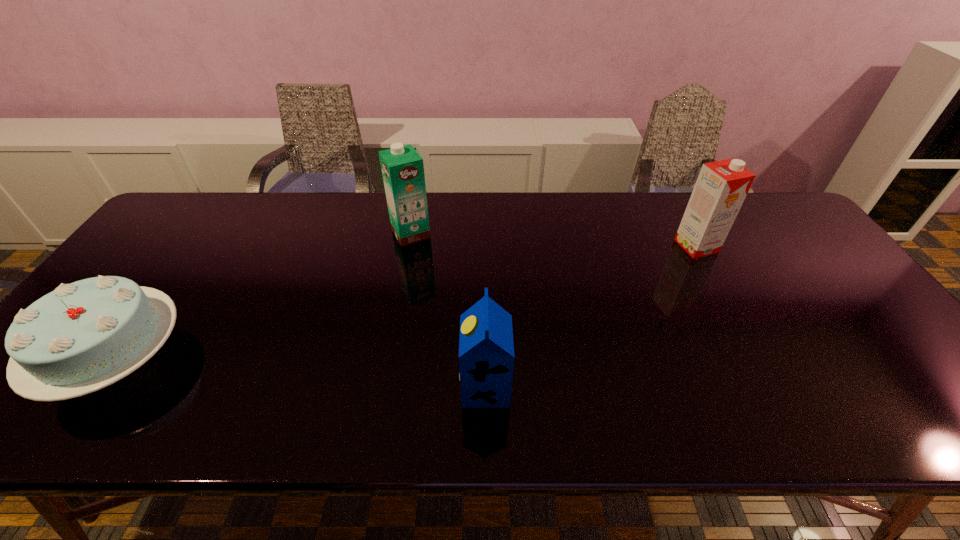
Find the location of a particular element. This screenshot has width=960, height=540. vacant space at the far edge of the desktop is located at coordinates (530, 212).

You are a GUI agent. You are given a task and a screenshot of the screen. Output one action in this format:
    pyautogui.click(x=<x>, y=<y>)
    Task: Click on the free region at the near edge of the desktop
    The width and height of the screenshot is (960, 540).
    Given the screenshot: What is the action you would take?
    pyautogui.click(x=324, y=422)

Where is `vacant space at the left edge of the desktop`? This screenshot has height=540, width=960. vacant space at the left edge of the desktop is located at coordinates pyautogui.click(x=155, y=272).

You are a GUI agent. You are given a task and a screenshot of the screen. Output one action in this format:
    pyautogui.click(x=<x>, y=<y>)
    Task: Click on the free space at the near right corner
    This screenshot has width=960, height=540.
    Given the screenshot: What is the action you would take?
    pyautogui.click(x=923, y=417)

Locate an element on the screen. The width and height of the screenshot is (960, 540). vacant space that's between the third object from right to left and the second carton from left to right is located at coordinates (448, 310).

The width and height of the screenshot is (960, 540). In order to click on unoccupied area between the leftmost carton and the second carton from right to left in this screenshot , I will do `click(448, 310)`.

This screenshot has width=960, height=540. In order to click on vacant area that lies between the rightmost carton and the leftmost carton in this screenshot , I will do `click(554, 240)`.

Where is `free area in between the second object from left to right and the rightmost carton`? The width and height of the screenshot is (960, 540). free area in between the second object from left to right and the rightmost carton is located at coordinates (554, 240).

This screenshot has width=960, height=540. What are the coordinates of `vacant area between the nearest carton and the rightmost object` in the screenshot? It's located at (591, 316).

Locate which object ranks third in proximity to the rightmost object. Please provide its 2D coordinates. Your answer should be formatted as a tuple, i.e. [(x, y)], where the tuple contains the x and y coordinates of a point satisfying the conditions above.

[(83, 336)]